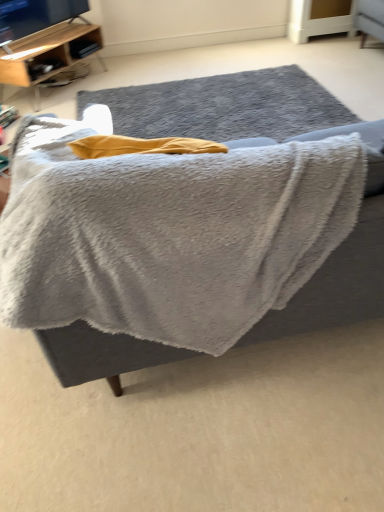
Question: Would you say wooden shelf at upper left is outside gray fluffy blanket at center?

Choices:
 (A) no
 (B) yes

Answer: (B)

Question: Does wooden shelf at upper left have a larger size compared to gray fluffy blanket at center?

Choices:
 (A) yes
 (B) no

Answer: (B)

Question: Does wooden shelf at upper left have a lesser width compared to gray fluffy blanket at center?

Choices:
 (A) no
 (B) yes

Answer: (B)

Question: Does wooden shelf at upper left turn towards gray fluffy blanket at center?

Choices:
 (A) yes
 (B) no

Answer: (B)

Question: From the image's perspective, is wooden shelf at upper left above gray fluffy blanket at center?

Choices:
 (A) no
 (B) yes

Answer: (B)

Question: From a real-world perspective, is wooden shelf at upper left under gray fluffy blanket at center?

Choices:
 (A) no
 (B) yes

Answer: (B)

Question: Is gray woolen rug at center thinner than wooden shelf at upper left?

Choices:
 (A) yes
 (B) no

Answer: (B)

Question: From the image's perspective, is gray woolen rug at center below wooden shelf at upper left?

Choices:
 (A) no
 (B) yes

Answer: (B)

Question: Can you confirm if gray woolen rug at center is shorter than wooden shelf at upper left?

Choices:
 (A) yes
 (B) no

Answer: (A)

Question: Is gray woolen rug at center not within wooden shelf at upper left?

Choices:
 (A) yes
 (B) no

Answer: (A)

Question: Is gray woolen rug at center closer to camera compared to wooden shelf at upper left?

Choices:
 (A) yes
 (B) no

Answer: (A)

Question: Does gray woolen rug at center have a greater width compared to wooden shelf at upper left?

Choices:
 (A) no
 (B) yes

Answer: (B)

Question: From the image's perspective, is gray fluffy blanket at center located beneath gray woolen rug at center?

Choices:
 (A) no
 (B) yes

Answer: (B)